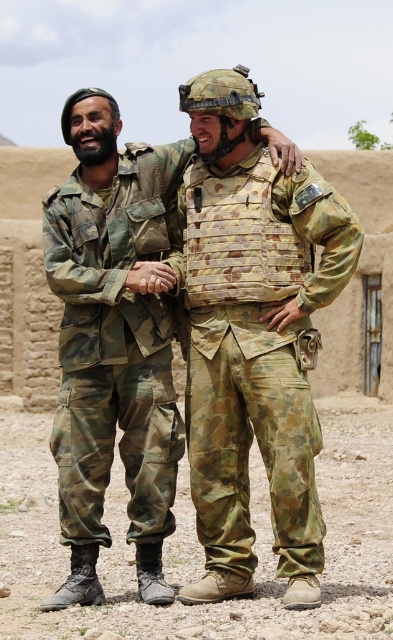
Is point (139, 214) less distant than point (293, 189)?

No.

Is camouflage uniform at center smaller than camouflage fabric vest at center?

No.

Image resolution: width=393 pixels, height=640 pixels. What are the coordinates of `camouflage uniform at center` in the screenshot? It's located at (112, 342).

Describe the element at coordinates (257, 355) in the screenshot. I see `camouflage fabric vest at center` at that location.

Which of these two, camouflage fabric vest at center or camouflage fabric pants at left, stands shorter?

With less height is camouflage fabric vest at center.

At what (x,y) coordinates should I click in order to perform the action: click on camouflage fabric vest at center. Please return your answer as a coordinate pair (x, y). The width and height of the screenshot is (393, 640). Looking at the image, I should click on (257, 355).

Identify the location of camouflage fabric vest at center. (257, 355).

Who is positioned more to the right, camouflage uniform at center or camouflage fabric pants at left?

Positioned to the right is camouflage uniform at center.

Which is in front, point (170, 317) or point (91, 372)?

Point (91, 372) is in front.

Is point (130, 385) behind point (82, 397)?

Yes, point (130, 385) is farther from viewer.

The height and width of the screenshot is (640, 393). In order to click on camouflage uniform at center in this screenshot , I will do click(x=112, y=342).